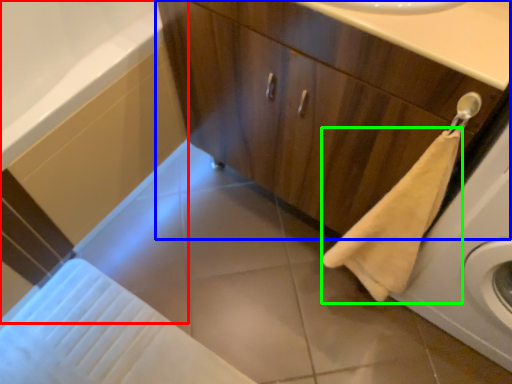
Question: Considering the real-world distances, which object is farthest from bath (highlighted by a red box)? bathroom cabinet (highlighted by a blue box) or bath towel (highlighted by a green box)?

Choices:
 (A) bathroom cabinet
 (B) bath towel

Answer: (B)